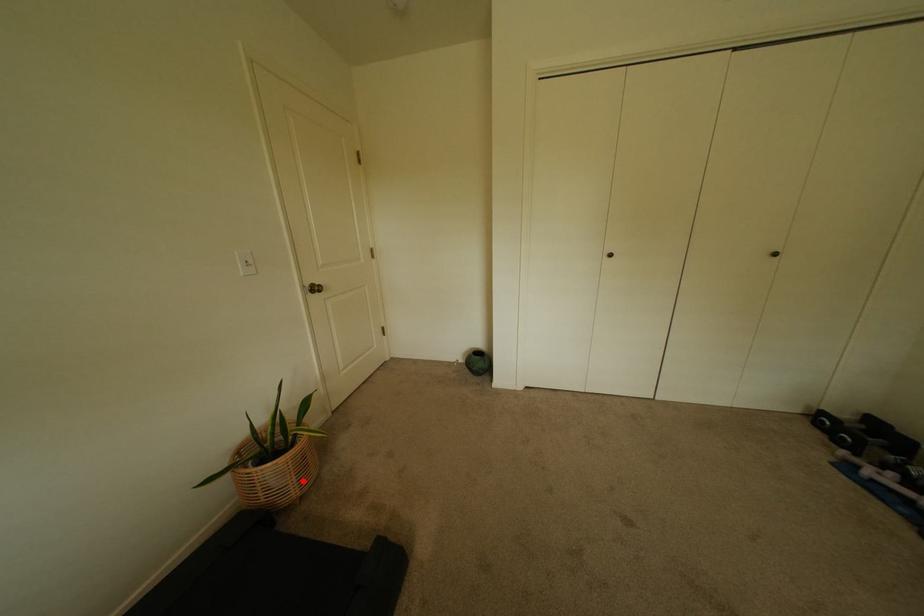
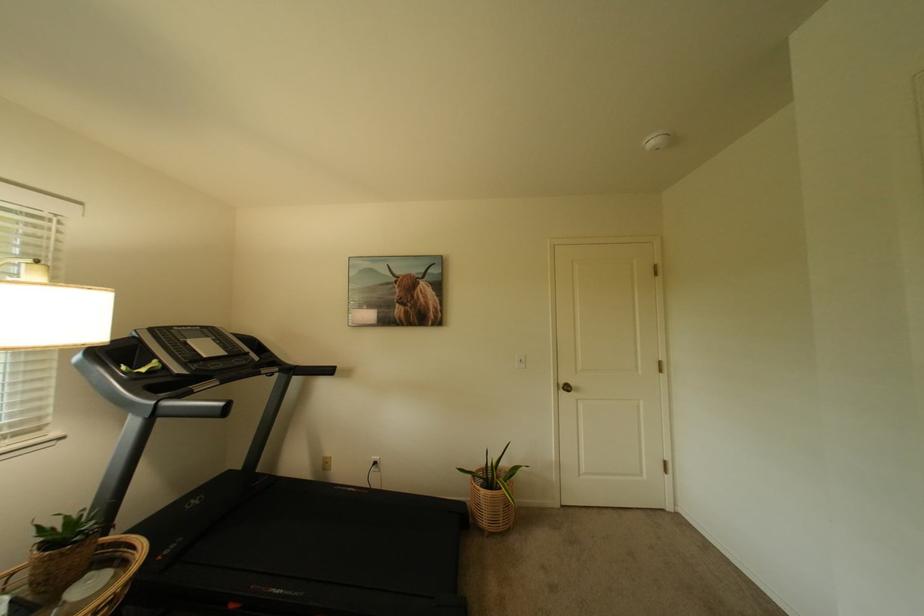
Question: I am providing you with two images of the same scene from different viewpoints. In image1, a red point is highlighted. Considering the same 3D point in image2, which of the following is correct?

Choices:
 (A) It is closer
 (B) It is farther

Answer: (B)